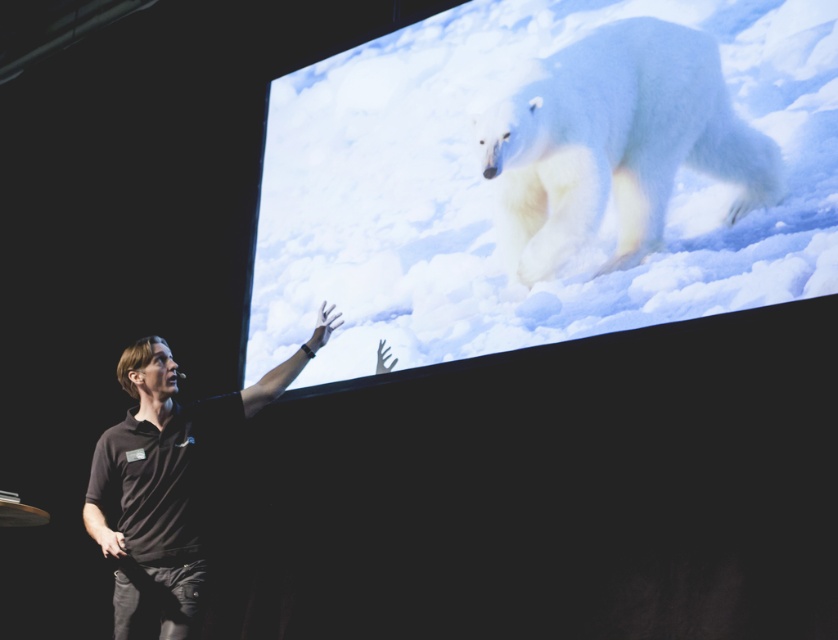
Can you confirm if white fur polar bear at upper center is thinner than black cotton shirt at lower left?

No.

Between white fur polar bear at upper center and black cotton shirt at lower left, which one has less height?

black cotton shirt at lower left

Where is `white fur polar bear at upper center`? white fur polar bear at upper center is located at coordinates (507, 177).

Is white fur polar bear at upper center positioned behind white fluffy polar bear at upper right?

No, it is not.

Which is more to the right, white fur polar bear at upper center or white fluffy polar bear at upper right?

Answer: Positioned to the right is white fluffy polar bear at upper right.

Is point (583, 275) closer to camera compared to point (505, 205)?

Yes.

Find the location of a particular element. The width and height of the screenshot is (838, 640). white fur polar bear at upper center is located at coordinates (507, 177).

Is point (623, 154) closer to camera compared to point (164, 621)?

No, (623, 154) is further to viewer.

Does white fluffy polar bear at upper right have a lesser width compared to black cotton shirt at lower left?

In fact, white fluffy polar bear at upper right might be wider than black cotton shirt at lower left.

Which is in front, point (621, 76) or point (262, 378)?

Positioned in front is point (262, 378).

In order to click on white fluffy polar bear at upper right in this screenshot , I will do [x=616, y=144].